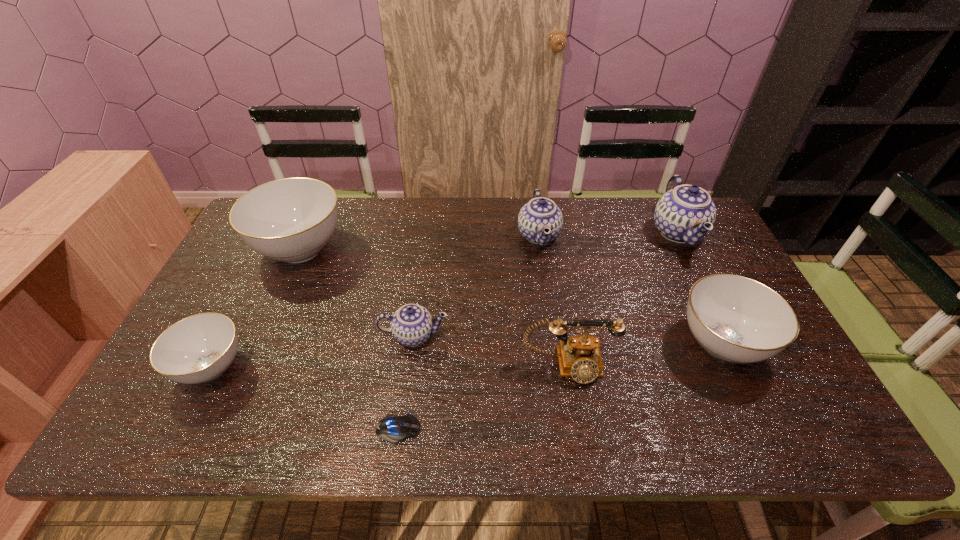
This screenshot has height=540, width=960. In order to click on vacant area situated 0.230m on the right of the smallest gray chinaware in this screenshot , I will do `click(342, 367)`.

I want to click on vacant space located 0.330m on the button side of the computer mouse, so click(570, 429).

Where is `object located in the near edge section of the desktop`? object located in the near edge section of the desktop is located at coordinates (393, 428).

Locate an element on the screen. The width and height of the screenshot is (960, 540). object that is positioned at the far left corner is located at coordinates (291, 220).

The image size is (960, 540). What are the coordinates of `object situated at the far right corner` in the screenshot? It's located at (685, 214).

This screenshot has height=540, width=960. In the image, there is a desktop. In order to click on vacant space at the far edge in this screenshot , I will do `click(373, 207)`.

Find the location of a particular element. The image size is (960, 540). vacant space at the left edge of the desktop is located at coordinates (252, 265).

Find the location of a particular element. Image resolution: width=960 pixels, height=540 pixels. vacant space at the right edge of the desktop is located at coordinates pyautogui.click(x=795, y=403).

At what (x,y) coordinates should I click in order to perform the action: click on vacant region at the near left corner. Please return your answer as a coordinate pair (x, y). This screenshot has height=540, width=960. Looking at the image, I should click on (212, 411).

At what (x,y) coordinates should I click in order to perform the action: click on vacant area that lies between the smallest blue chinaware and the telephone. Please return your answer as a coordinate pair (x, y). The image size is (960, 540). Looking at the image, I should click on (492, 351).